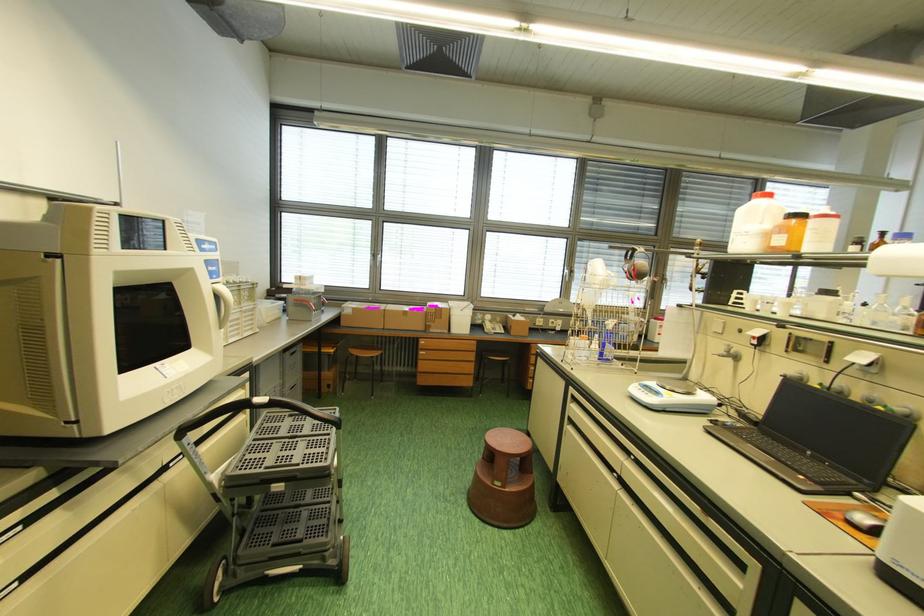
The image size is (924, 616). What do you see at coordinates (223, 302) in the screenshot?
I see `the white machine handle` at bounding box center [223, 302].